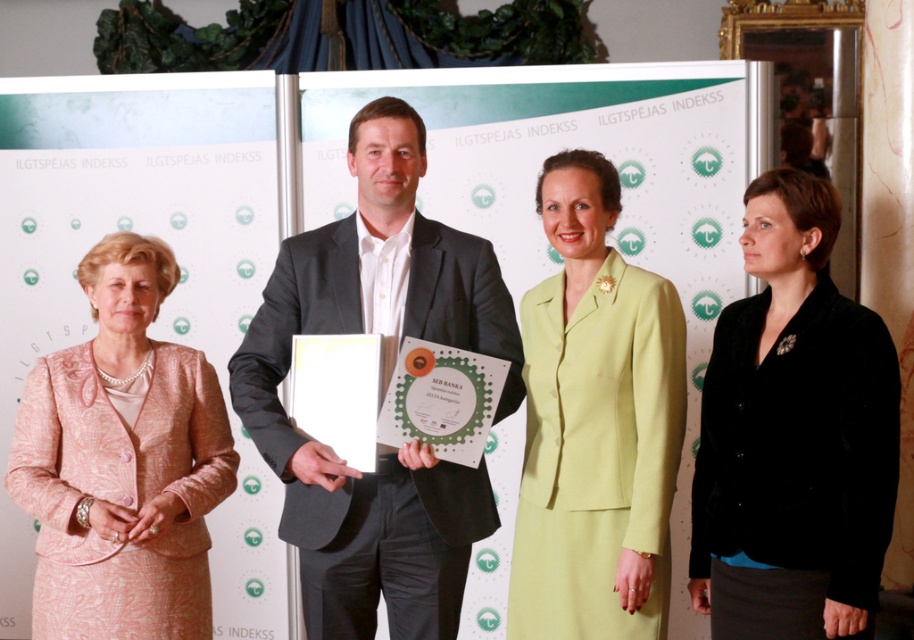
Question: Which object appears farthest from the camera in this image?

Choices:
 (A) lime green fabric suit at center
 (B) pink textured suit at left

Answer: (A)

Question: Does lime green fabric suit at center have a lesser width compared to pink textured suit at left?

Choices:
 (A) yes
 (B) no

Answer: (A)

Question: Which object appears closest to the camera in this image?

Choices:
 (A) dark gray suit at center
 (B) black velvet blazer at right
 (C) pink textured suit at left
 (D) lime green fabric suit at center

Answer: (B)

Question: Can you confirm if dark gray suit at center is bigger than lime green fabric suit at center?

Choices:
 (A) yes
 (B) no

Answer: (A)

Question: Can you confirm if dark gray suit at center is smaller than pink textured suit at left?

Choices:
 (A) yes
 (B) no

Answer: (B)

Question: Which object is the closest to the black velvet blazer at right?

Choices:
 (A) pink textured suit at left
 (B) lime green fabric suit at center

Answer: (B)